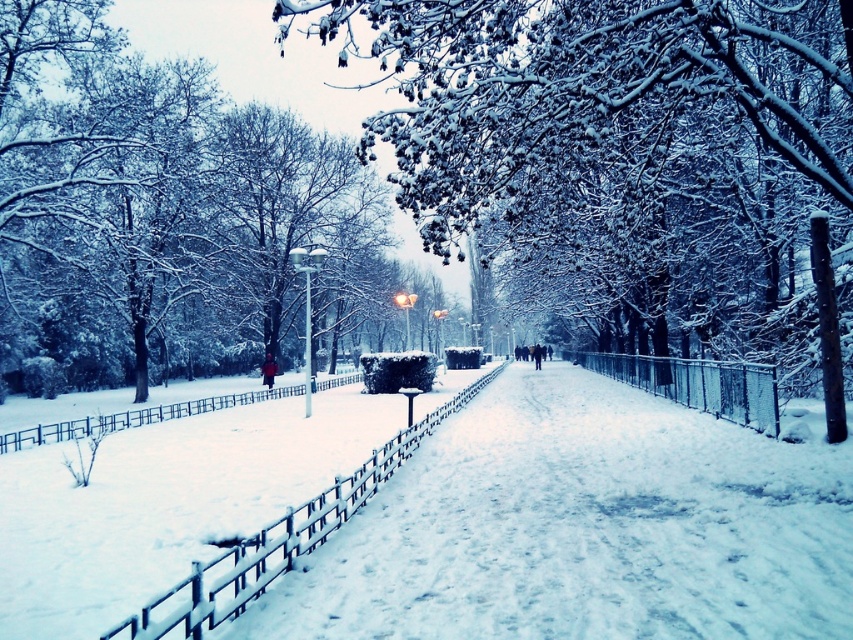
You are standing at the camera position and want to walk to both points in the winter scene. Which point, point (758, 132) or point (194, 237), will you reach first?

You will reach point (758, 132) first because it is closer to the camera than point (194, 237).

You are standing at the point closer to the camera between point (x=403, y=52) and point (x=318, y=502). You want to walk towards the farther point. Which direction should you move?

You should move towards point (x=403, y=52) because it is further to the camera than point (x=318, y=502).